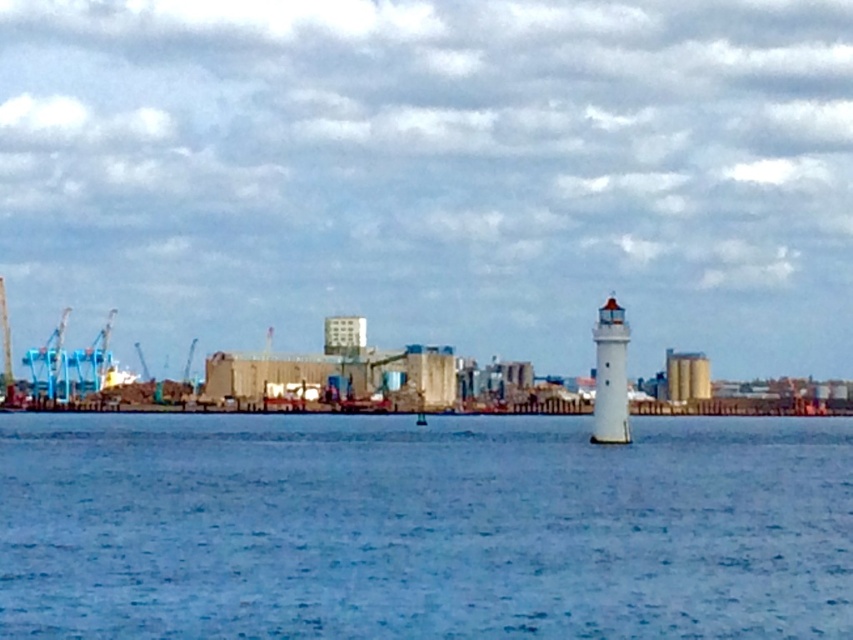
Question: Is white textured lighthouse at right to the left of smooth beige silo at center right from the viewer's perspective?

Choices:
 (A) no
 (B) yes

Answer: (B)

Question: Is white textured lighthouse at right to the left of smooth beige silo at center right from the viewer's perspective?

Choices:
 (A) yes
 (B) no

Answer: (A)

Question: Based on their relative distances, which object is nearer to the smooth beige silo at center right?

Choices:
 (A) white textured lighthouse at right
 (B) blue water at center

Answer: (B)

Question: Can you confirm if blue water at center is wider than smooth beige silo at center right?

Choices:
 (A) no
 (B) yes

Answer: (B)

Question: Estimate the real-world distances between objects in this image. Which object is closer to the white textured lighthouse at right?

Choices:
 (A) smooth concrete silo at center
 (B) smooth beige silo at center right

Answer: (B)

Question: Which point is closer to the camera?

Choices:
 (A) smooth concrete silo at center
 (B) smooth beige silo at center right
 (C) white textured lighthouse at right

Answer: (C)